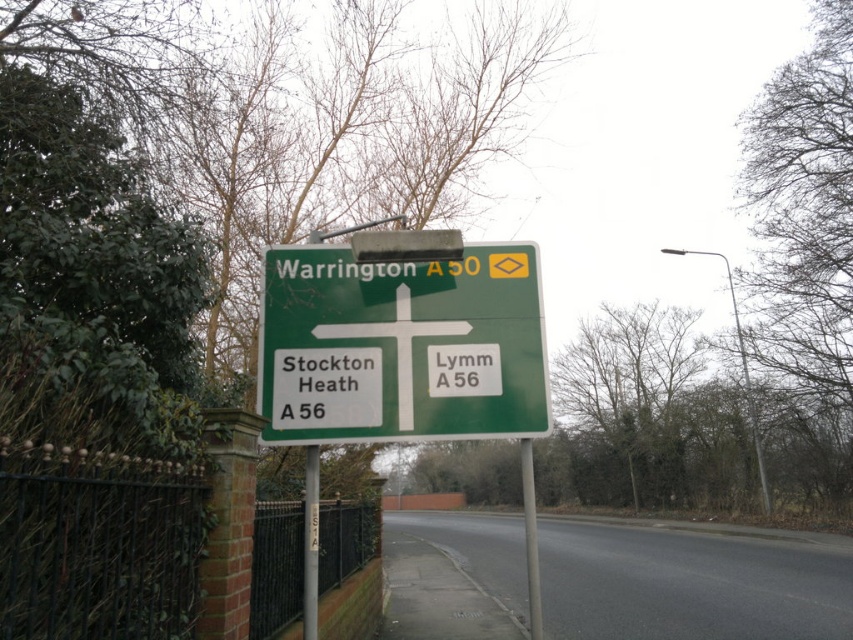
You are a driver approaching the road sign and need to choose between the green matte sign at center and the green plastic sign at center. Which one is closer to you?

The green matte sign at center is closer to you because it is in front of the green plastic sign at center.

You are a driver approaching the road sign and need to choose between the green matte sign at center and the green plastic sign at center. Which one is positioned to the left side from your perspective?

The green matte sign at center is positioned to the left of the green plastic sign at center, so the green matte sign at center is on the left side from your perspective.